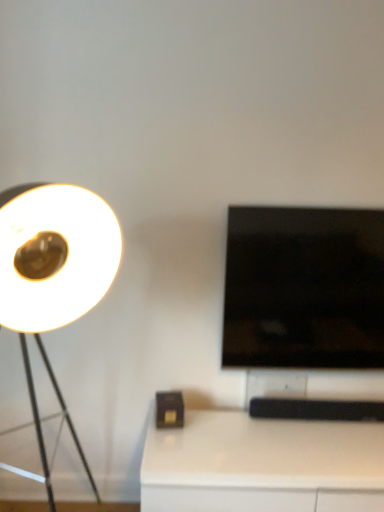
Question: Is white glossy table at lower right not inside black glossy tv at right?

Choices:
 (A) no
 (B) yes

Answer: (B)

Question: Is the position of white glossy table at lower right more distant than that of black glossy tv at right?

Choices:
 (A) no
 (B) yes

Answer: (A)

Question: Would you say black glossy tv at right is part of white glossy table at lower right's contents?

Choices:
 (A) yes
 (B) no

Answer: (B)

Question: Does white glossy table at lower right come in front of black glossy tv at right?

Choices:
 (A) yes
 (B) no

Answer: (A)

Question: Considering the relative positions of white glossy table at lower right and black glossy tv at right in the image provided, is white glossy table at lower right to the right of black glossy tv at right from the viewer's perspective?

Choices:
 (A) no
 (B) yes

Answer: (A)

Question: Does white glossy table at lower right have a smaller size compared to black glossy tv at right?

Choices:
 (A) no
 (B) yes

Answer: (A)

Question: Is black glossy tv at right a part of white matte lamp at left?

Choices:
 (A) yes
 (B) no

Answer: (B)

Question: Is black glossy tv at right at the back of white matte lamp at left?

Choices:
 (A) no
 (B) yes

Answer: (A)

Question: Can you confirm if white matte lamp at left is shorter than black glossy tv at right?

Choices:
 (A) yes
 (B) no

Answer: (B)

Question: Does white matte lamp at left touch black glossy tv at right?

Choices:
 (A) no
 (B) yes

Answer: (A)

Question: Does white matte lamp at left have a smaller size compared to black glossy tv at right?

Choices:
 (A) yes
 (B) no

Answer: (B)

Question: From the image's perspective, is white matte lamp at left on top of black glossy tv at right?

Choices:
 (A) yes
 (B) no

Answer: (B)

Question: Can you confirm if white matte lamp at left is wider than white glossy table at lower right?

Choices:
 (A) no
 (B) yes

Answer: (B)